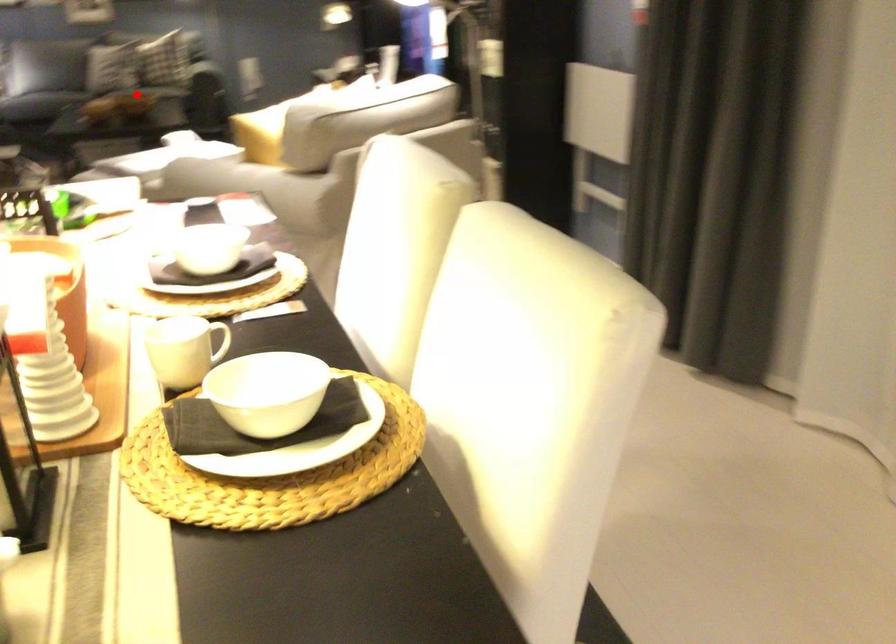
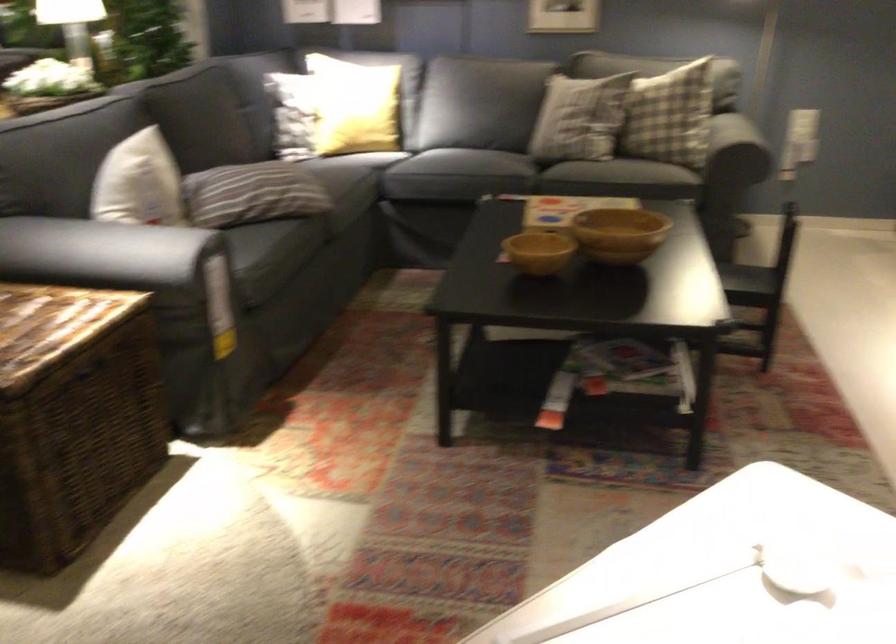
Question: A red point is marked in image1. In image2, is the corresponding 3D point closer to the camera or farther? Reply with the corresponding letter.

Choices:
 (A) The corresponding 3D point is closer.
 (B) The corresponding 3D point is farther.

Answer: (A)